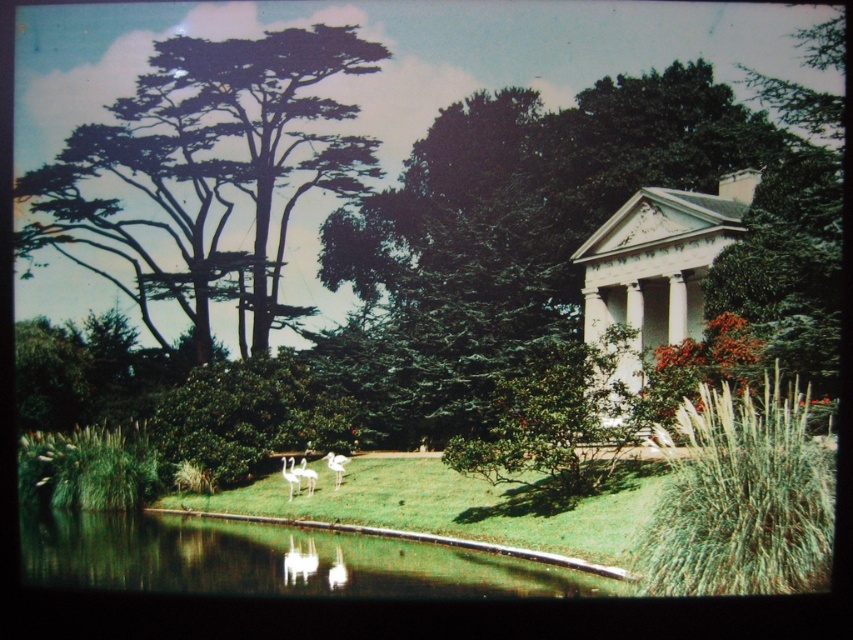
Looking at this image, you are planning to place a decorative statue that is 2 meters wide in the garden. The statue must be placed where there is enough space. Which object between the white glossy gazebo at right and the white feathered swan at center can accommodate the statue without overlapping? Please explain your reasoning.

The white glossy gazebo at right has a greater width than the white feathered swan at center. Since the statue is 2 meters wide, the gazebo area likely provides sufficient space to place the statue without overlapping.

You are standing at the edge of the pond in the garden scene. You want to walk directly to the clear water at pond center located at point (276, 561). Is there any object between you and the clear water at pond center that you need to avoid?

There are three flamingos on the grassy bank near the water, but they are not between you and the clear water at pond center located at point (276, 561). You can walk directly to the clear water at pond center without needing to avoid any objects in your path.

You are standing in the garden scene and want to reach the point marked as point (x=527, y=577). If your walking speed is 1.5 meters per second, how many seconds will it take you to reach that point?

The distance between you and point (x=527, y=577) is 39.47 meters. At a speed of 1.5 meters per second, it will take approximately 26.3 seconds to reach the point.